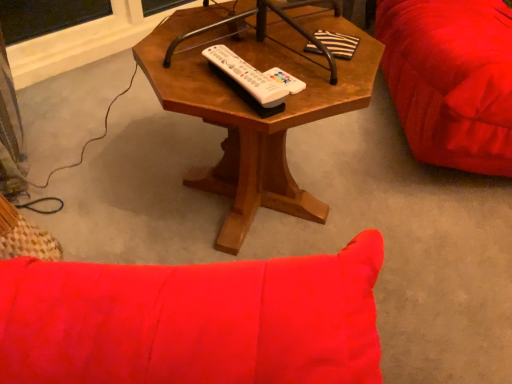
Question: Relative to wooden hexagonal table at center, is white plastic remote at center in front or behind?

Choices:
 (A) behind
 (B) front

Answer: (A)

Question: Do you think white plastic remote at center is within wooden hexagonal table at center, or outside of it?

Choices:
 (A) inside
 (B) outside

Answer: (A)

Question: Visually, is white plastic remote at center positioned to the left or to the right of wooden hexagonal table at center?

Choices:
 (A) left
 (B) right

Answer: (A)

Question: Choose the correct answer: Is wooden hexagonal table at center inside white plastic remote at center or outside it?

Choices:
 (A) outside
 (B) inside

Answer: (A)

Question: Considering the positions of point (174, 107) and point (224, 61), is point (174, 107) closer or farther from the camera than point (224, 61)?

Choices:
 (A) farther
 (B) closer

Answer: (A)

Question: Is wooden hexagonal table at center bigger or smaller than white plastic remote at center?

Choices:
 (A) small
 (B) big

Answer: (B)

Question: Based on their positions, is wooden hexagonal table at center located to the left or right of white plastic remote at center?

Choices:
 (A) right
 (B) left

Answer: (A)